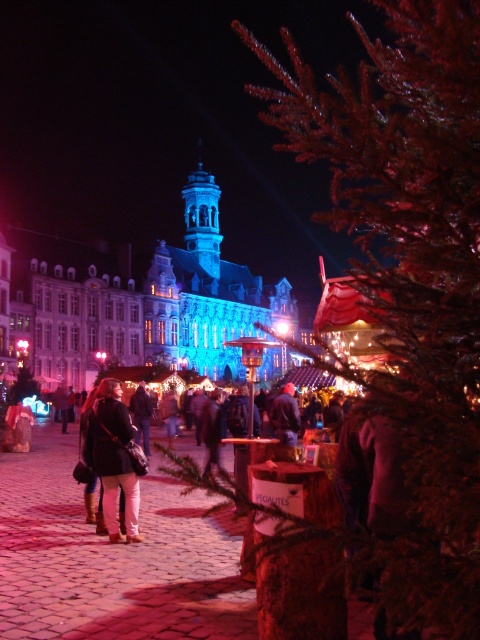
Does green textured pine tree at center appear over dark blue jacket at center?

Indeed, green textured pine tree at center is positioned over dark blue jacket at center.

Between green textured pine tree at center and dark blue jacket at center, which one appears on the right side from the viewer's perspective?

green textured pine tree at center is more to the right.

Does point (343, 189) come farther from viewer compared to point (282, 428)?

That is False.

The height and width of the screenshot is (640, 480). I want to click on green textured pine tree at center, so click(x=410, y=268).

Is point (408, 579) farther from camera compared to point (110, 518)?

No.

Is green textured pine tree at center bigger than matte black jacket at center?

Yes.

At what (x,y) coordinates should I click in order to perform the action: click on green textured pine tree at center. Please return your answer as a coordinate pair (x, y). Looking at the image, I should click on [x=410, y=268].

Image resolution: width=480 pixels, height=640 pixels. I want to click on green textured pine tree at center, so (410, 268).

Which of these two, matte black jacket at center or dark blue jacket at center, stands shorter?

dark blue jacket at center is shorter.

In the scene shown: Can you confirm if matte black jacket at center is positioned above dark blue jacket at center?

Actually, matte black jacket at center is below dark blue jacket at center.

Is point (116, 481) positioned after point (297, 420)?

No, (116, 481) is in front of (297, 420).

Image resolution: width=480 pixels, height=640 pixels. What are the coordinates of `matte black jacket at center` in the screenshot? It's located at (113, 458).